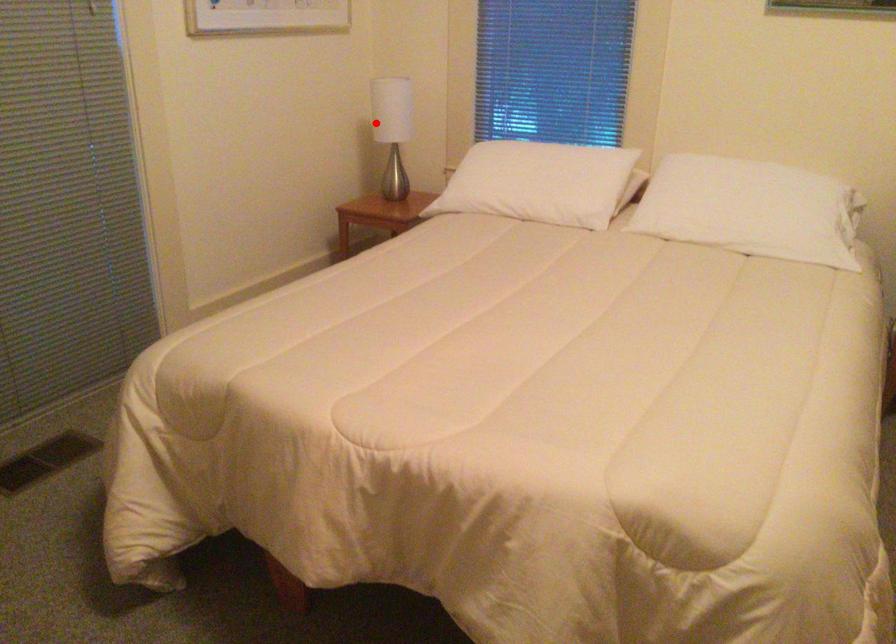
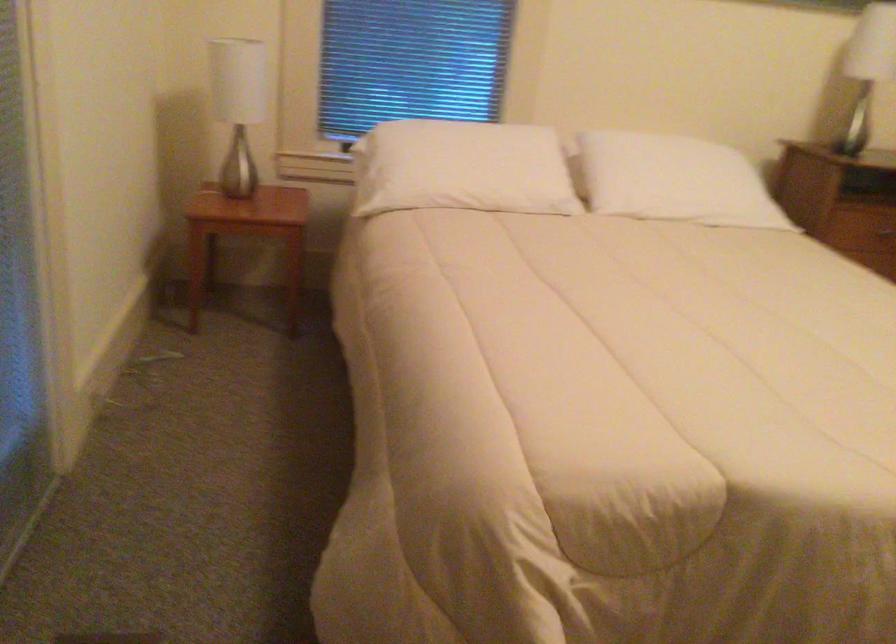
Question: A red point is marked in image1. In image2, is the corresponding 3D point closer to the camera or farther? Reply with the corresponding letter.

Choices:
 (A) The corresponding 3D point is closer.
 (B) The corresponding 3D point is farther.

Answer: (A)